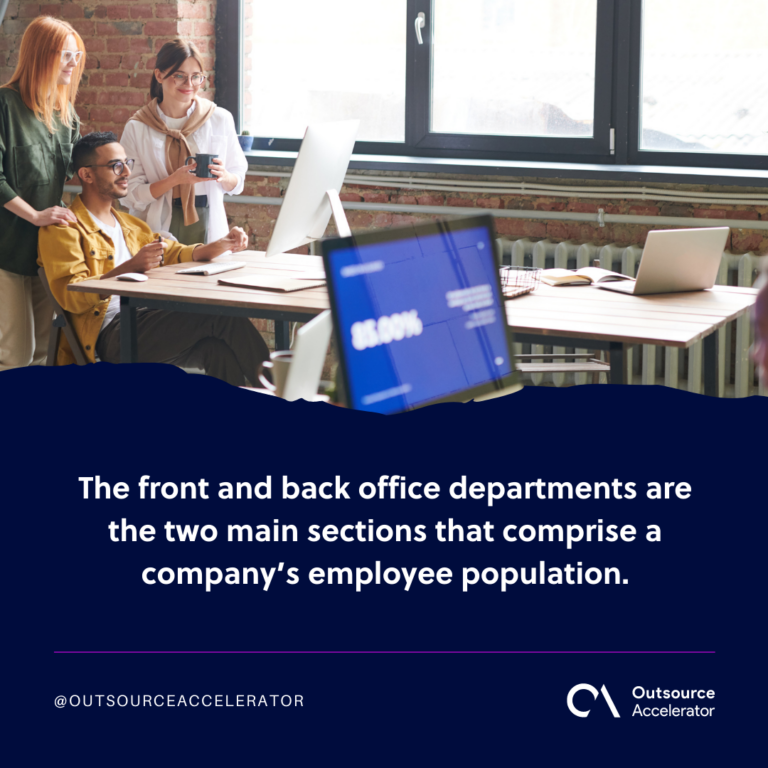
Identify the location of table. coord(561,310).